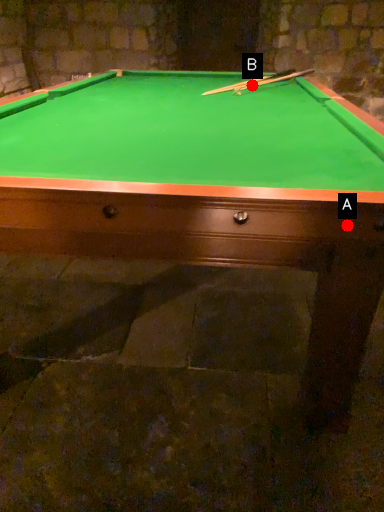
Question: Two points are circled on the image, labeled by A and B beside each circle. Which point appears farthest from the camera in this image?

Choices:
 (A) A is further
 (B) B is further

Answer: (B)